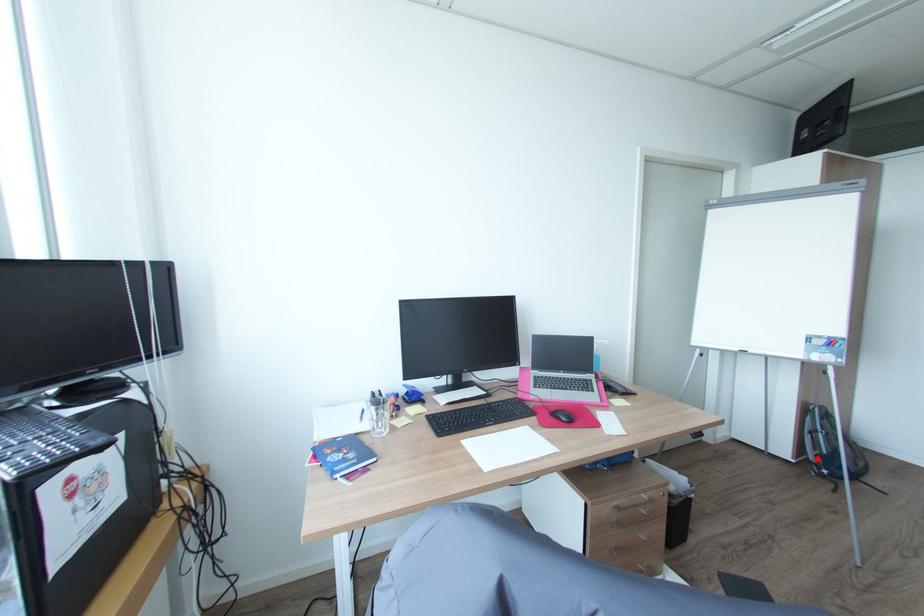
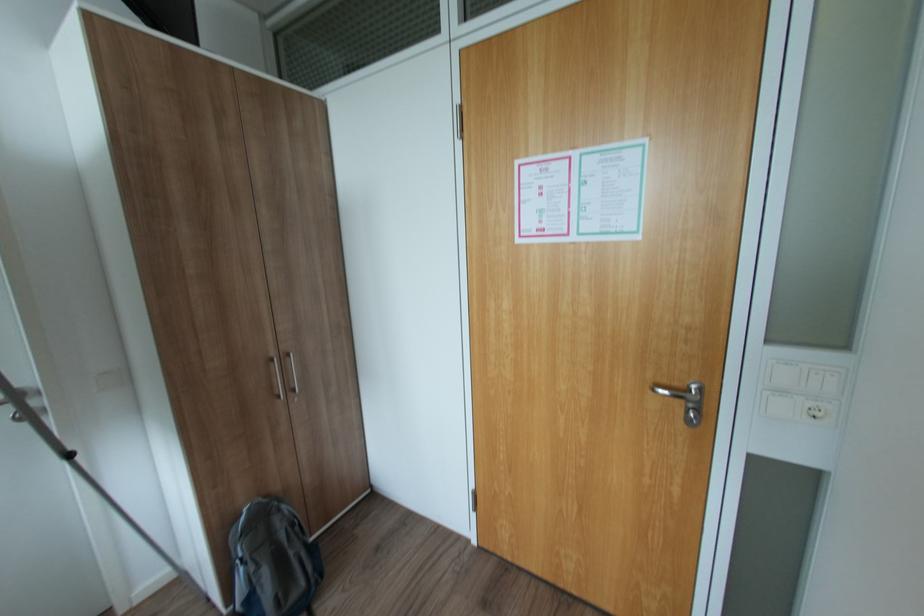
Question: I am providing you with two images of the same scene from different viewpoints. Given a red point in image1, look at the same physical point in image2. Is it:

Choices:
 (A) Closer to the viewpoint
 (B) Farther from the viewpoint

Answer: (B)